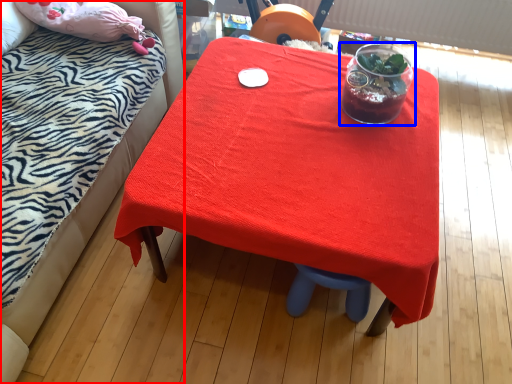
Question: Among these objects, which one is nearest to the camera, bed (highlighted by a red box) or tableware (highlighted by a blue box)?

Choices:
 (A) bed
 (B) tableware

Answer: (A)